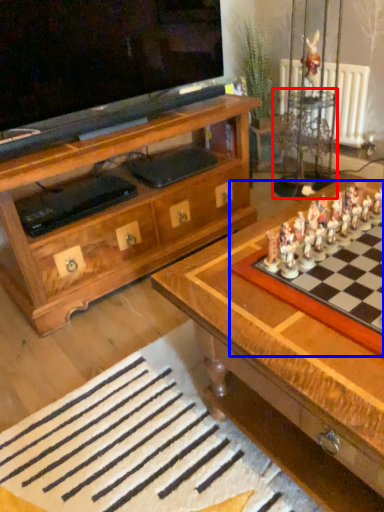
Question: Which object is further to the camera taking this photo, side table (highlighted by a red box) or board game (highlighted by a blue box)?

Choices:
 (A) side table
 (B) board game

Answer: (A)